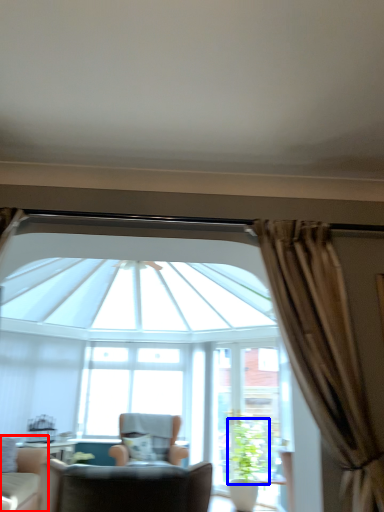
Question: Which object is further to the camera taking this photo, chair (highlighted by a red box) or plant (highlighted by a blue box)?

Choices:
 (A) chair
 (B) plant

Answer: (B)